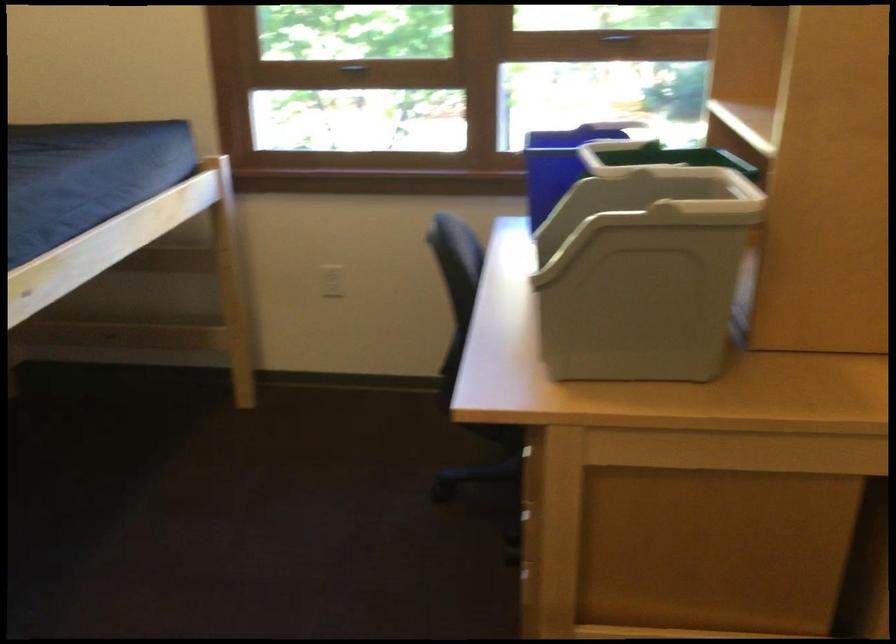
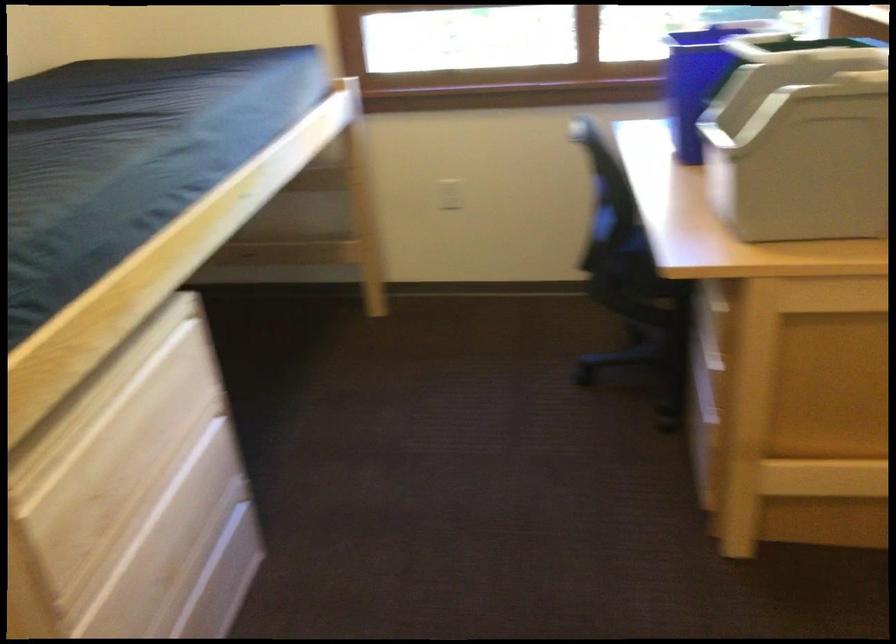
Question: The first image is from the beginning of the video and the second image is from the end. How did the camera likely rotate when shooting the video?

Choices:
 (A) Left
 (B) Right
 (C) Up
 (D) Down

Answer: (D)